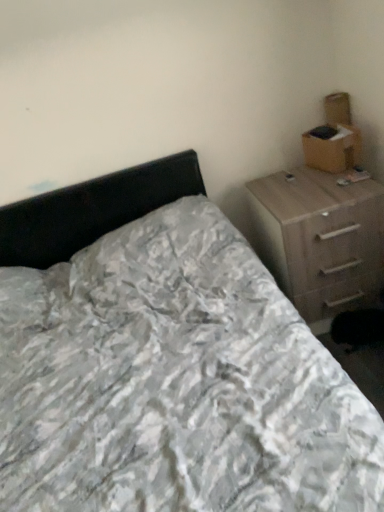
Question: Is brown cardboard box at upper right spatially inside light brown wood chest of drawers at right, or outside of it?

Choices:
 (A) outside
 (B) inside

Answer: (A)

Question: In terms of width, does brown cardboard box at upper right look wider or thinner when compared to light brown wood chest of drawers at right?

Choices:
 (A) thin
 (B) wide

Answer: (A)

Question: Considering the real-world distances, which object is farthest from the light brown wood chest of drawers at right?

Choices:
 (A) brown cardboard box at upper right
 (B) white textured bed at center

Answer: (B)

Question: Which object is the closest to the brown cardboard box at upper right?

Choices:
 (A) white textured bed at center
 (B) light brown wood chest of drawers at right

Answer: (B)